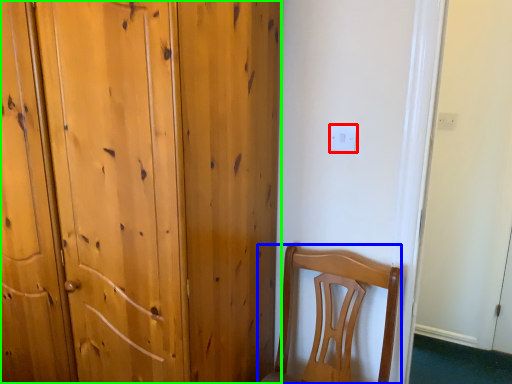
Question: Estimate the real-world distances between objects in this image. Which object is farther from electric outlet (highlighted by a red box), chair (highlighted by a blue box) or door (highlighted by a green box)?

Choices:
 (A) chair
 (B) door

Answer: (B)